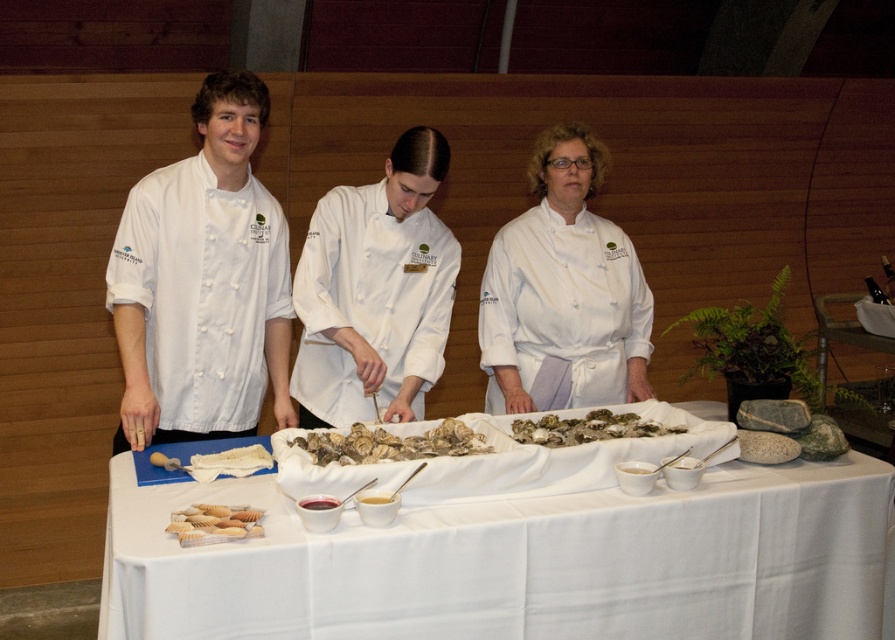
Find the location of a particular element. white matte uniform at left is located at coordinates (203, 284).

How distant is white matte uniform at left from greenish-brown shell at center?

38.20 inches

Which is behind, point (166, 273) or point (535, 438)?

The point (166, 273) is more distant.

The width and height of the screenshot is (895, 640). In order to click on white matte uniform at left in this screenshot , I will do `click(203, 284)`.

From the picture: Between white cloth at center and white chef coat at center, which one has less height?

white cloth at center

Who is positioned more to the right, white cloth at center or white chef coat at center?

From the viewer's perspective, white chef coat at center appears more on the right side.

In order to click on white cloth at center in this screenshot , I will do `click(521, 557)`.

Between point (607, 374) and point (598, 426), which one is positioned in front?

Positioned in front is point (598, 426).

Where is `white chef coat at center`? Image resolution: width=895 pixels, height=640 pixels. white chef coat at center is located at coordinates (563, 292).

Locate an element on the screen. white chef coat at center is located at coordinates (563, 292).